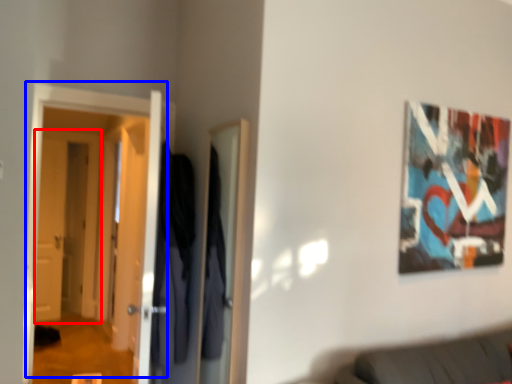
Question: Which object appears closest to the camera in this image, door (highlighted by a red box) or door (highlighted by a blue box)?

Choices:
 (A) door
 (B) door

Answer: (B)